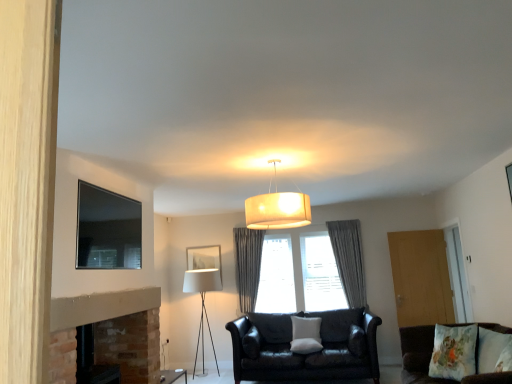
Question: Is fluffy floral pillow at lower right, which is counted as the 1th pillow, starting from the top, not within wooden door at right, the second glass door positioned from the right?

Choices:
 (A) no
 (B) yes

Answer: (B)

Question: Does fluffy floral pillow at lower right, acting as the 2th pillow starting from the back, have a greater height compared to wooden door at right, which is the first glass door from left to right?

Choices:
 (A) no
 (B) yes

Answer: (A)

Question: Is fluffy floral pillow at lower right, which ranks as the second pillow in bottom-to-top order, to the right of wooden door at right, which is the first glass door from left to right, from the viewer's perspective?

Choices:
 (A) yes
 (B) no

Answer: (B)

Question: Considering the relative sizes of fluffy floral pillow at lower right, arranged as the 1th pillow when viewed from the front, and wooden door at right, the second glass door positioned from the right, in the image provided, is fluffy floral pillow at lower right, arranged as the 1th pillow when viewed from the front, shorter than wooden door at right, the second glass door positioned from the right,?

Choices:
 (A) yes
 (B) no

Answer: (A)

Question: Is fluffy floral pillow at lower right, which ranks as the second pillow in bottom-to-top order, smaller than wooden door at right, which is the first glass door from left to right?

Choices:
 (A) yes
 (B) no

Answer: (A)

Question: Considering their positions, is matte black couch at center, the first studio couch viewed from the back, located in front of or behind gray fabric curtain at center, positioned as the first curtain in left-to-right order?

Choices:
 (A) behind
 (B) front

Answer: (B)

Question: Considering the positions of matte black couch at center, the first studio couch viewed from the back, and gray fabric curtain at center, positioned as the first curtain in left-to-right order, in the image, is matte black couch at center, the first studio couch viewed from the back, bigger or smaller than gray fabric curtain at center, positioned as the first curtain in left-to-right order,?

Choices:
 (A) big
 (B) small

Answer: (A)

Question: Is matte black couch at center, the first studio couch viewed from the back, wider or thinner than gray fabric curtain at center, placed as the 2th curtain when sorted from right to left?

Choices:
 (A) wide
 (B) thin

Answer: (A)

Question: From the image's perspective, is matte black couch at center, the first studio couch viewed from the back, above or below gray fabric curtain at center, placed as the 2th curtain when sorted from right to left?

Choices:
 (A) below
 (B) above

Answer: (A)

Question: Is gray fabric curtain at center, which is counted as the first curtain, starting from the right, spatially inside matte black tv at upper left, the 1th picture frame in the left-to-right sequence, or outside of it?

Choices:
 (A) outside
 (B) inside

Answer: (A)

Question: Relative to matte black tv at upper left, which is counted as the 1th picture frame, starting from the top, is gray fabric curtain at center, marked as the second curtain in a left-to-right arrangement, in front or behind?

Choices:
 (A) behind
 (B) front

Answer: (A)

Question: Is gray fabric curtain at center, marked as the second curtain in a left-to-right arrangement, wider or thinner than matte black tv at upper left, the 1th picture frame in the left-to-right sequence?

Choices:
 (A) thin
 (B) wide

Answer: (B)

Question: From a real-world perspective, is gray fabric curtain at center, which is counted as the first curtain, starting from the right, physically located above or below matte black tv at upper left, which is counted as the 1th picture frame, starting from the top?

Choices:
 (A) below
 (B) above

Answer: (A)

Question: Looking at the image, does fluffy floral pillow at lower right, arranged as the 1th pillow when viewed from the front, seem bigger or smaller compared to gray fabric curtain at center?

Choices:
 (A) small
 (B) big

Answer: (A)

Question: Would you say fluffy floral pillow at lower right, which ranks as the second pillow in bottom-to-top order, is to the left or to the right of gray fabric curtain at center in the picture?

Choices:
 (A) left
 (B) right

Answer: (B)